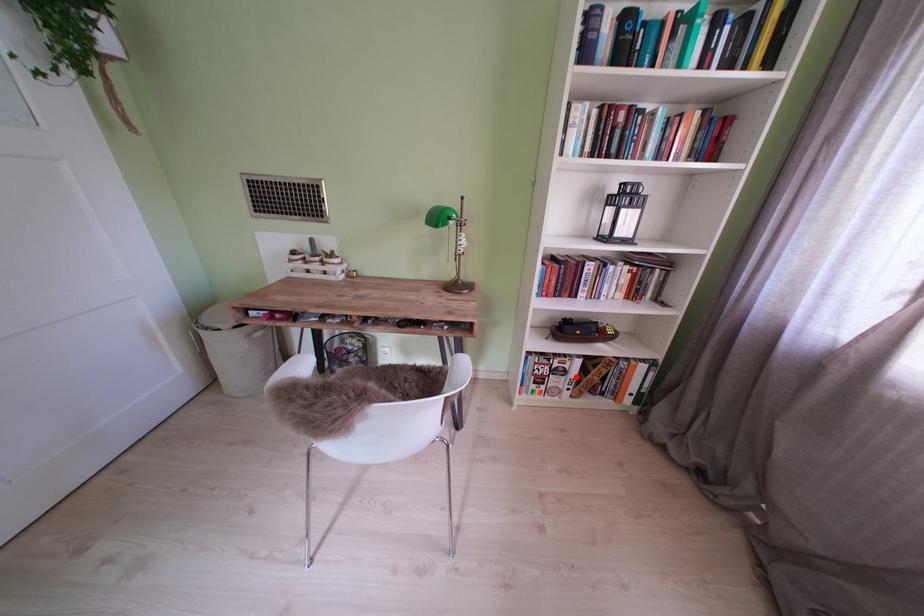
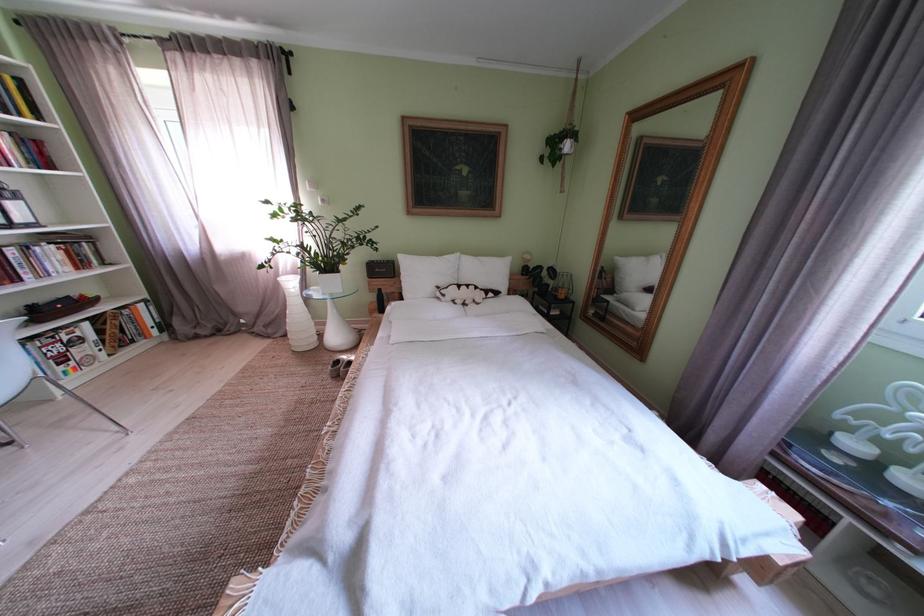
The point at the highlighted location is marked in the first image. Where is the corresponding point in the second image?

(92, 344)